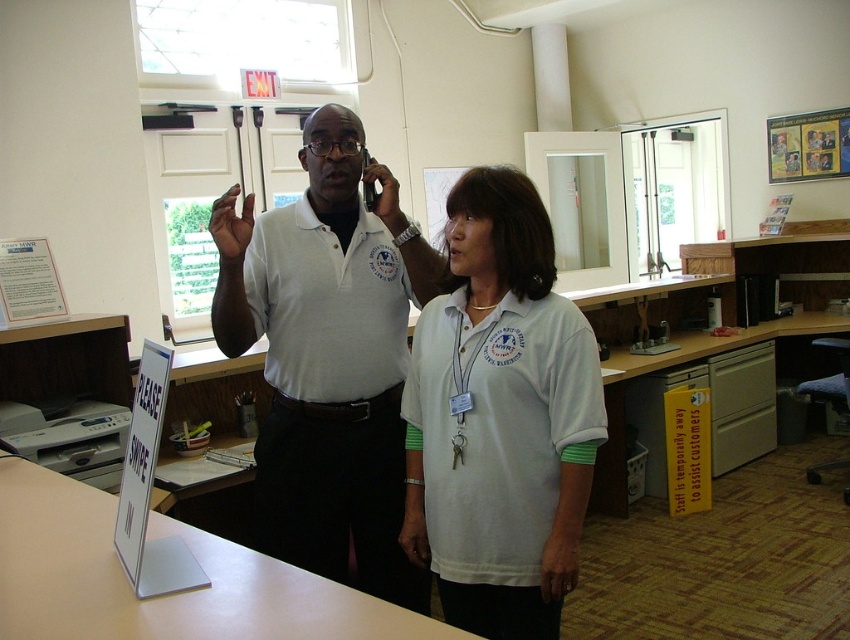
Question: Can you confirm if white cotton shirt at center is positioned to the right of white matte shirt at center?

Choices:
 (A) no
 (B) yes

Answer: (B)

Question: Does white cotton shirt at center have a larger size compared to white matte shirt at center?

Choices:
 (A) no
 (B) yes

Answer: (A)

Question: Does white cotton shirt at center have a greater width compared to white matte shirt at center?

Choices:
 (A) no
 (B) yes

Answer: (A)

Question: Which object appears closest to the camera in this image?

Choices:
 (A) white cotton shirt at center
 (B) white matte shirt at center

Answer: (A)

Question: Which point appears farthest from the camera in this image?

Choices:
 (A) (490, 564)
 (B) (286, 452)

Answer: (B)

Question: Which point is farther from the camera taking this photo?

Choices:
 (A) (387, 337)
 (B) (565, 417)

Answer: (A)